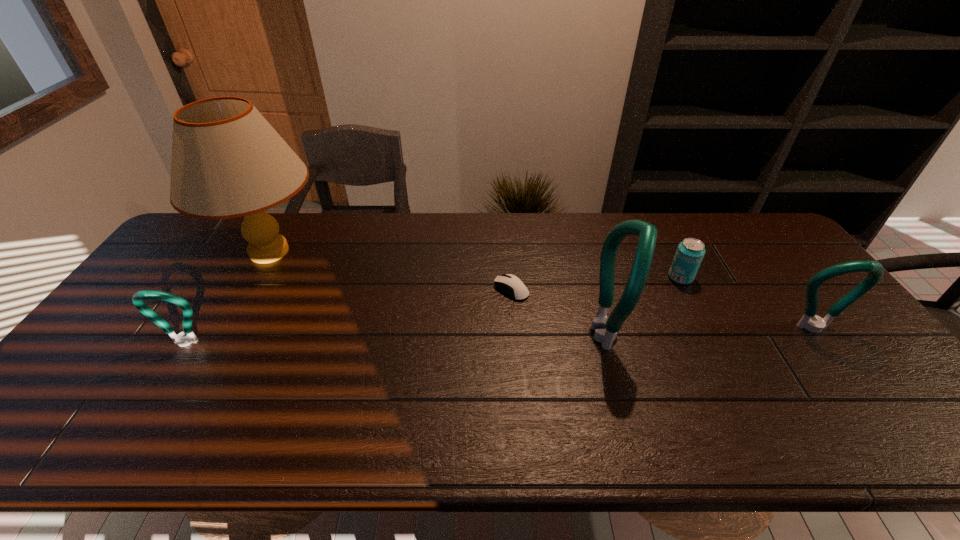
The width and height of the screenshot is (960, 540). I want to click on beer can, so click(690, 252).

Identify the location of vacant space located 0.070m at the jaws of the leftmost bottle opener. Image resolution: width=960 pixels, height=540 pixels. (165, 374).

Where is `vacant region located at the jaws of the fourth object from left to right`? The width and height of the screenshot is (960, 540). vacant region located at the jaws of the fourth object from left to right is located at coordinates (666, 334).

Identify the location of free space located 0.210m at the jaws of the rightmost bottle opener. The width and height of the screenshot is (960, 540). (873, 409).

Where is `free region located 0.360m on the right of the tallest object`? free region located 0.360m on the right of the tallest object is located at coordinates (438, 252).

At what (x,y) coordinates should I click in order to perform the action: click on blank space located 0.300m on the front of the fourth object from right to left. Please return your answer as a coordinate pair (x, y). Looking at the image, I should click on (519, 393).

This screenshot has width=960, height=540. I want to click on vacant space located on the front of the beer can, so click(x=718, y=353).

Where is `object that is at the far edge`? object that is at the far edge is located at coordinates (227, 161).

Where is `object at the left edge`? object at the left edge is located at coordinates (227, 161).

Where is `object that is at the right edge`? object that is at the right edge is located at coordinates 816,324.